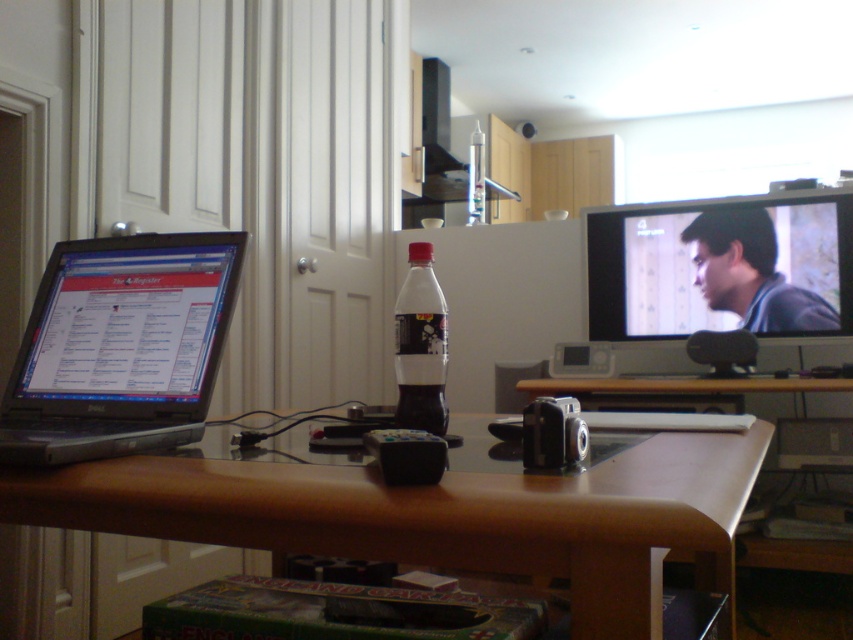
Question: Among these points, which one is farthest from the camera?

Choices:
 (A) (686, 378)
 (B) (151, 467)

Answer: (A)

Question: Which point is closer to the camera?

Choices:
 (A) (670, 326)
 (B) (410, 328)
 (C) (80, 451)
 (D) (281, 492)

Answer: (D)

Question: Considering the relative positions of brown wood computer desk at center and black matte soda bottle at center in the image provided, where is brown wood computer desk at center located with respect to black matte soda bottle at center?

Choices:
 (A) left
 (B) right

Answer: (B)

Question: Can you confirm if matte black laptop at left is smaller than black matte soda bottle at center?

Choices:
 (A) no
 (B) yes

Answer: (A)

Question: Which point is closer to the camera taking this photo?

Choices:
 (A) pos(509,538)
 (B) pos(741,560)
 (C) pos(698,244)
 (D) pos(485,173)

Answer: (A)

Question: Can you confirm if brown wood table at center is smaller than brown wood computer desk at center?

Choices:
 (A) no
 (B) yes

Answer: (A)